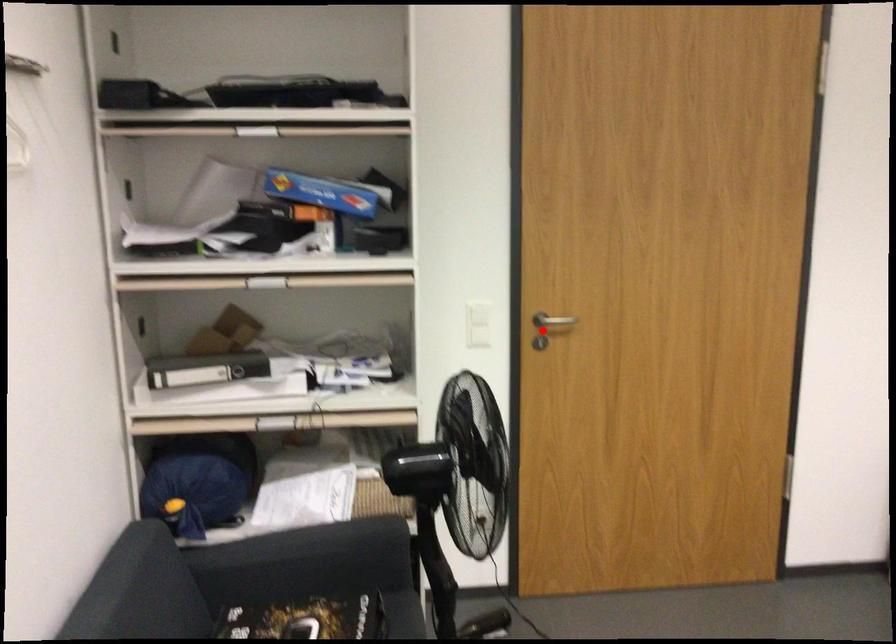
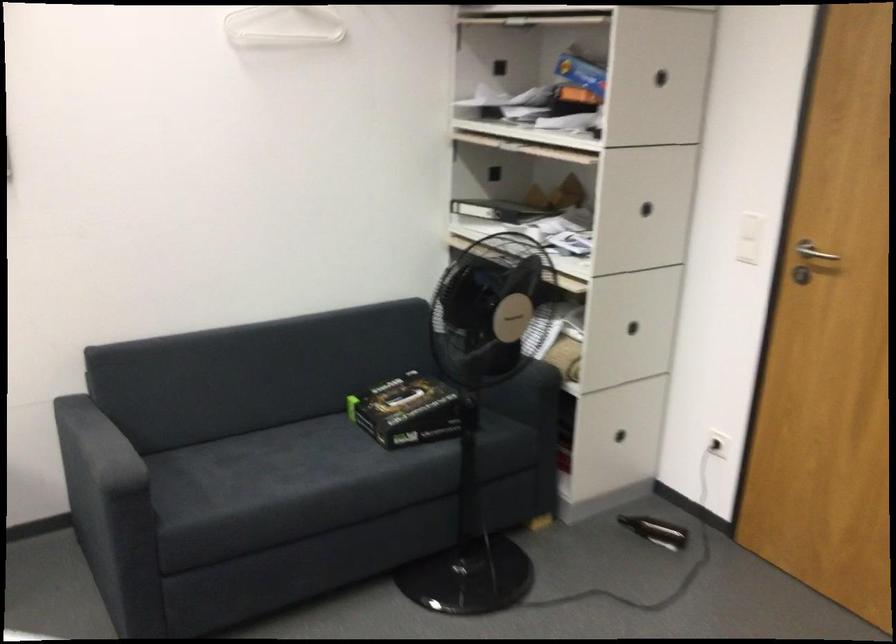
Question: I am providing you with two images of the same scene from different viewpoints. Given a red point in image1, look at the same physical point in image2. Is it:

Choices:
 (A) Closer to the viewpoint
 (B) Farther from the viewpoint

Answer: (A)